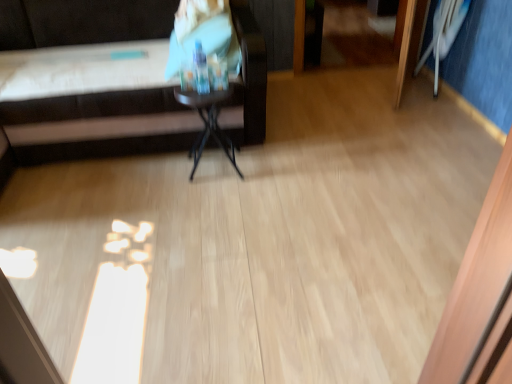
Question: Does white plastic swivel chair at upper right come in front of black glossy side table at center?

Choices:
 (A) no
 (B) yes

Answer: (A)

Question: Considering the relative positions of white plastic swivel chair at upper right and black glossy side table at center in the image provided, is white plastic swivel chair at upper right to the right of black glossy side table at center from the viewer's perspective?

Choices:
 (A) yes
 (B) no

Answer: (A)

Question: Can you confirm if white plastic swivel chair at upper right is thinner than black glossy side table at center?

Choices:
 (A) yes
 (B) no

Answer: (A)

Question: Is white plastic swivel chair at upper right positioned behind black glossy side table at center?

Choices:
 (A) yes
 (B) no

Answer: (A)

Question: Considering the relative sizes of white plastic swivel chair at upper right and black glossy side table at center in the image provided, is white plastic swivel chair at upper right taller than black glossy side table at center?

Choices:
 (A) no
 (B) yes

Answer: (B)

Question: Is the surface of white plastic swivel chair at upper right in direct contact with black glossy side table at center?

Choices:
 (A) no
 (B) yes

Answer: (A)

Question: Does black glossy side table at center appear on the left side of white plastic swivel chair at upper right?

Choices:
 (A) no
 (B) yes

Answer: (B)

Question: From the image's perspective, is black glossy side table at center on white plastic swivel chair at upper right?

Choices:
 (A) no
 (B) yes

Answer: (A)

Question: Can you confirm if black glossy side table at center is wider than white plastic swivel chair at upper right?

Choices:
 (A) yes
 (B) no

Answer: (A)

Question: Is black glossy side table at center oriented towards white plastic swivel chair at upper right?

Choices:
 (A) yes
 (B) no

Answer: (B)

Question: Can white plastic swivel chair at upper right be found inside black glossy side table at center?

Choices:
 (A) no
 (B) yes

Answer: (A)

Question: Is the position of black glossy side table at center less distant than that of white plastic swivel chair at upper right?

Choices:
 (A) yes
 (B) no

Answer: (A)

Question: Can matte plastic bottle at upper center be found inside brown leather couch at upper left?

Choices:
 (A) no
 (B) yes

Answer: (B)